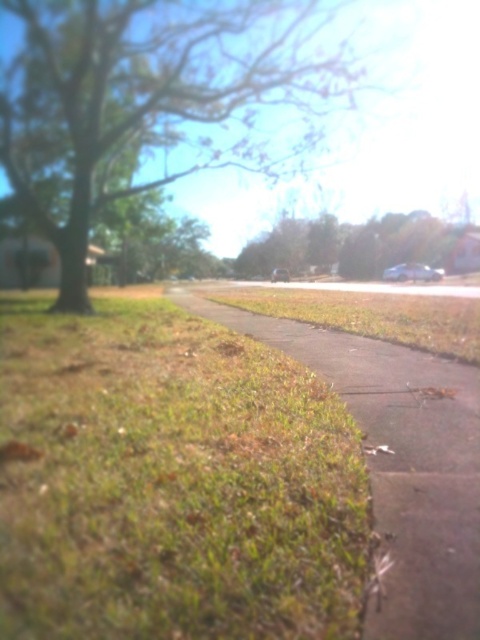
Which is behind, point (29, 481) or point (19, 108)?

The point (19, 108) is behind.

Can you confirm if green grass at lower left is positioned to the right of green leafy tree at upper left?

In fact, green grass at lower left is to the left of green leafy tree at upper left.

Which is behind, point (86, 432) or point (189, 166)?

The point (189, 166) is more distant.

Where is `green grass at lower left`? green grass at lower left is located at coordinates (171, 481).

Can you confirm if green grassy pavement at lower center is thinner than green leafy tree at center?

Yes, green grassy pavement at lower center is thinner than green leafy tree at center.

Is green grassy pavement at lower center shorter than green leafy tree at center?

Correct, green grassy pavement at lower center is not as tall as green leafy tree at center.

Is point (406, 380) farther from camera compared to point (319, 269)?

That is False.

The height and width of the screenshot is (640, 480). In order to click on green grassy pavement at lower center in this screenshot , I will do pos(398,465).

Is green grass at lower left smaller than green leafy tree at center?

Yes.

Can you confirm if green grass at lower left is taller than green leafy tree at center?

Incorrect, green grass at lower left's height is not larger of green leafy tree at center's.

Locate an element on the screen. The width and height of the screenshot is (480, 640). green grass at lower left is located at coordinates (171, 481).